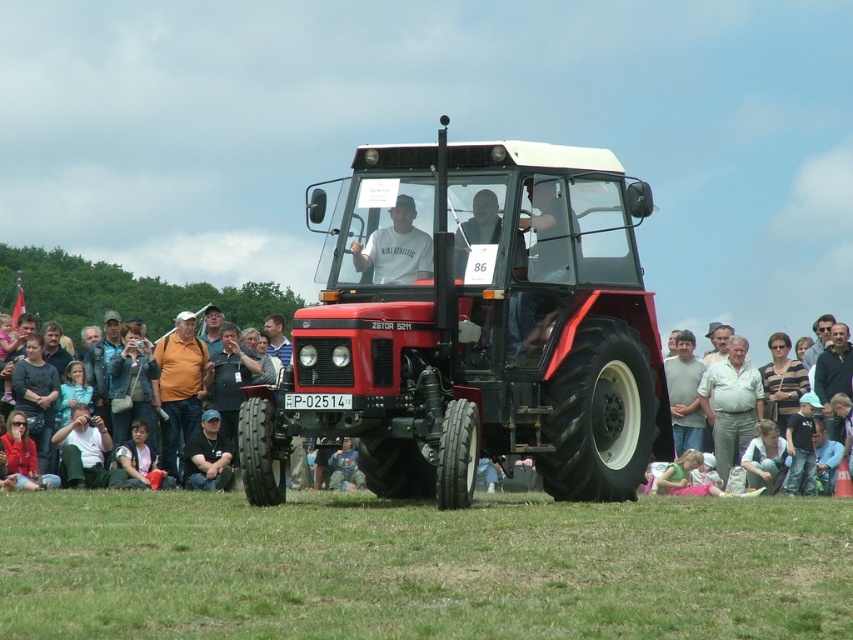
Question: Estimate the real-world distances between objects in this image. Which object is farther from the orange fabric shirt at center?

Choices:
 (A) denim jacket at lower left
 (B) striped fabric shirt at center
 (C) dark gray sweater at lower left

Answer: (B)

Question: Which point is closer to the camera?

Choices:
 (A) green grass at lower center
 (B) striped fabric shirt at center
 (C) denim jacket at left
 (D) light brown fabric crowd at center

Answer: (A)

Question: Which point is farther from the camera taking this photo?

Choices:
 (A) (316, 401)
 (B) (722, 472)

Answer: (B)

Question: Can you confirm if matte white shirt at center is thinner than dark gray sweater at lower left?

Choices:
 (A) yes
 (B) no

Answer: (A)

Question: Can you confirm if light brown fabric crowd at center is smaller than light beige pants at center?

Choices:
 (A) no
 (B) yes

Answer: (B)

Question: Does dark gray sweater at lower left appear on the right side of striped fabric shirt at center?

Choices:
 (A) no
 (B) yes

Answer: (A)